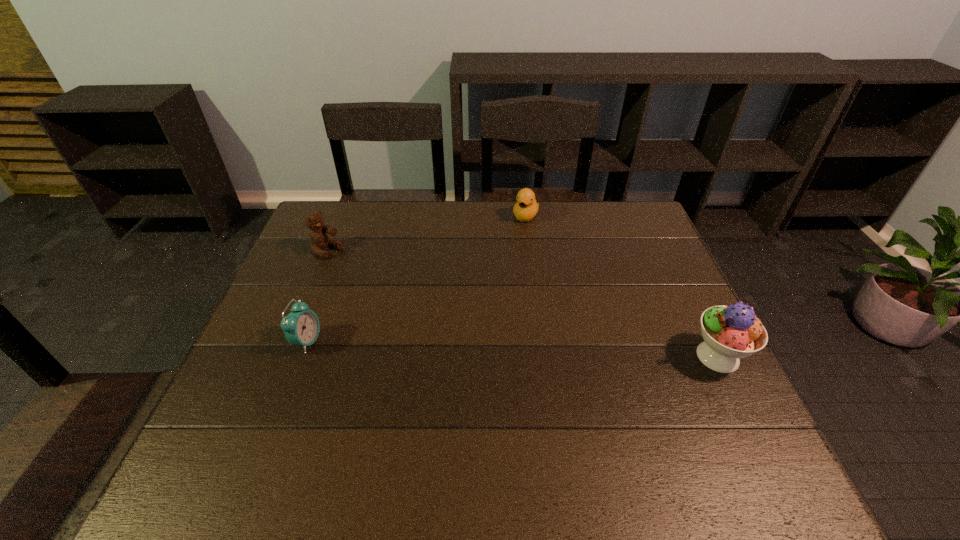
Locate an element on the screen. This screenshot has width=960, height=540. alarm clock is located at coordinates (301, 327).

Where is `icecream`? The image size is (960, 540). icecream is located at coordinates (731, 332).

At what (x,y) coordinates should I click in order to perform the action: click on the rightmost object. Please return your answer as a coordinate pair (x, y). Image resolution: width=960 pixels, height=540 pixels. Looking at the image, I should click on (731, 332).

Image resolution: width=960 pixels, height=540 pixels. I want to click on duckling, so click(x=526, y=207).

The image size is (960, 540). In order to click on the farthest object in this screenshot , I will do `click(526, 207)`.

Find the location of a particular element. The image size is (960, 540). the third nearest object is located at coordinates [319, 239].

You are a GUI agent. You are given a task and a screenshot of the screen. Output one action in this format:
    pyautogui.click(x=<x>, y=<y>)
    Task: Click on the vacant position located 0.220m on the face of the alarm clock
    This screenshot has height=540, width=960.
    Given the screenshot: What is the action you would take?
    pyautogui.click(x=408, y=342)

Locate an element on the screen. This screenshot has width=960, height=540. vacant space located on the front of the icecream is located at coordinates (739, 400).

The height and width of the screenshot is (540, 960). What are the coordinates of `free location located on the face of the duckling` in the screenshot? It's located at (503, 274).

This screenshot has width=960, height=540. I want to click on free space located on the face of the duckling, so click(x=503, y=274).